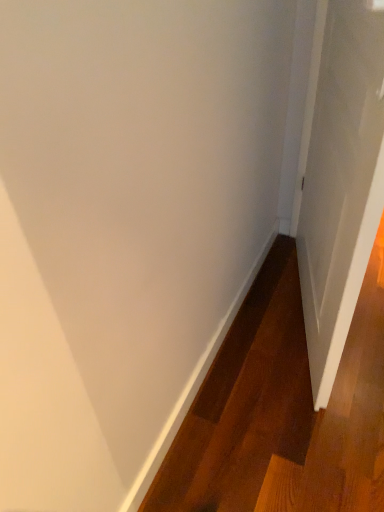
What do you see at coordinates (341, 182) in the screenshot? This screenshot has width=384, height=512. I see `white glossy door at lower right` at bounding box center [341, 182].

This screenshot has height=512, width=384. In order to click on white glossy door at lower right in this screenshot , I will do `click(341, 182)`.

What is the approximate height of white glossy door at lower right?

white glossy door at lower right is 3.74 feet in height.

You are a GUI agent. You are given a task and a screenshot of the screen. Output one action in this format:
    pyautogui.click(x=<x>, y=<y>)
    Task: Click on the white glossy door at lower right
    The height and width of the screenshot is (512, 384).
    Given the screenshot: What is the action you would take?
    pyautogui.click(x=341, y=182)